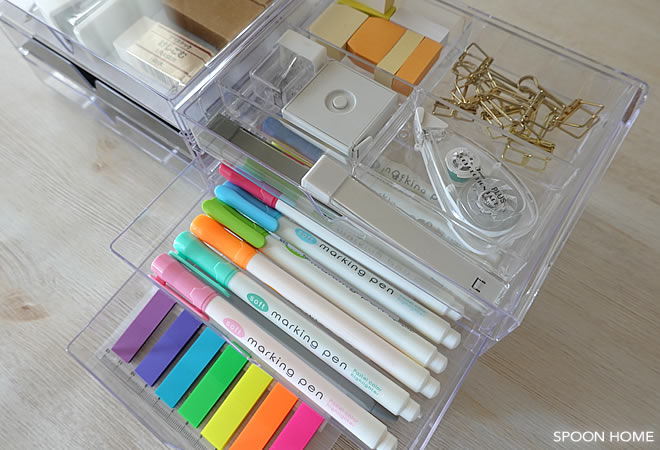
Identify the location of marker pens. (205, 299), (228, 276), (248, 253), (259, 234), (267, 222), (284, 211).